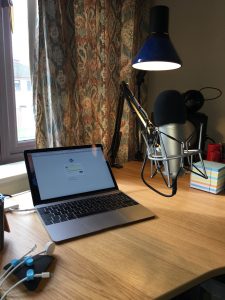
Locate an element on the screen. This screenshot has height=300, width=225. laptop is located at coordinates (163, 191), (72, 228).